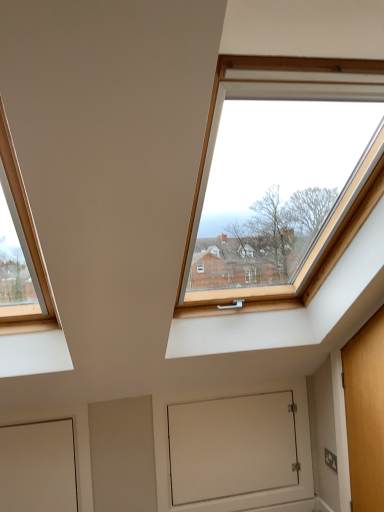
Question: Does white matte door at lower left, the 2th door in the right-to-left sequence, come behind white matte door at lower center?

Choices:
 (A) no
 (B) yes

Answer: (A)

Question: Can you confirm if white matte door at lower left, the 2th door in the right-to-left sequence, is bigger than white matte door at lower center?

Choices:
 (A) no
 (B) yes

Answer: (A)

Question: Considering the relative sizes of white matte door at lower left, the 2th door in the right-to-left sequence, and white matte door at lower center in the image provided, is white matte door at lower left, the 2th door in the right-to-left sequence, taller than white matte door at lower center?

Choices:
 (A) yes
 (B) no

Answer: (B)

Question: Is white matte door at lower left, the first door from the left, aimed at white matte door at lower center?

Choices:
 (A) no
 (B) yes

Answer: (A)

Question: Is white matte door at lower left, the first door from the left, at the right side of white matte door at lower center?

Choices:
 (A) no
 (B) yes

Answer: (A)

Question: Considering the positions of wooden door at right, the second door viewed from the left, and white matte door at lower left, the first door from the left, in the image, is wooden door at right, the second door viewed from the left, bigger or smaller than white matte door at lower left, the first door from the left,?

Choices:
 (A) big
 (B) small

Answer: (A)

Question: Is point (354, 352) closer or farther from the camera than point (61, 434)?

Choices:
 (A) farther
 (B) closer

Answer: (B)

Question: From a real-world perspective, is wooden door at right, marked as the 1th door in a right-to-left arrangement, above or below white matte door at lower left, the first door from the left?

Choices:
 (A) above
 (B) below

Answer: (A)

Question: Looking at their shapes, would you say wooden door at right, marked as the 1th door in a right-to-left arrangement, is wider or thinner than white matte door at lower left, the 2th door in the right-to-left sequence?

Choices:
 (A) wide
 (B) thin

Answer: (A)

Question: Looking at their shapes, would you say white matte door at lower left, the 2th door in the right-to-left sequence, is wider or thinner than wooden door at right, the second door viewed from the left?

Choices:
 (A) wide
 (B) thin

Answer: (B)

Question: In terms of size, does white matte door at lower left, the first door from the left, appear bigger or smaller than wooden door at right, marked as the 1th door in a right-to-left arrangement?

Choices:
 (A) big
 (B) small

Answer: (B)

Question: In the image, is white matte door at lower left, the first door from the left, positioned in front of or behind wooden door at right, the second door viewed from the left?

Choices:
 (A) behind
 (B) front

Answer: (A)

Question: Does point (31, 501) appear closer or farther from the camera than point (350, 339)?

Choices:
 (A) farther
 (B) closer

Answer: (A)

Question: Considering the positions of white matte door at lower left, the 2th door in the right-to-left sequence, and white matte door at lower center in the image, is white matte door at lower left, the 2th door in the right-to-left sequence, taller or shorter than white matte door at lower center?

Choices:
 (A) tall
 (B) short

Answer: (B)

Question: From the image's perspective, is white matte door at lower left, the 2th door in the right-to-left sequence, positioned above or below white matte door at lower center?

Choices:
 (A) below
 (B) above

Answer: (B)